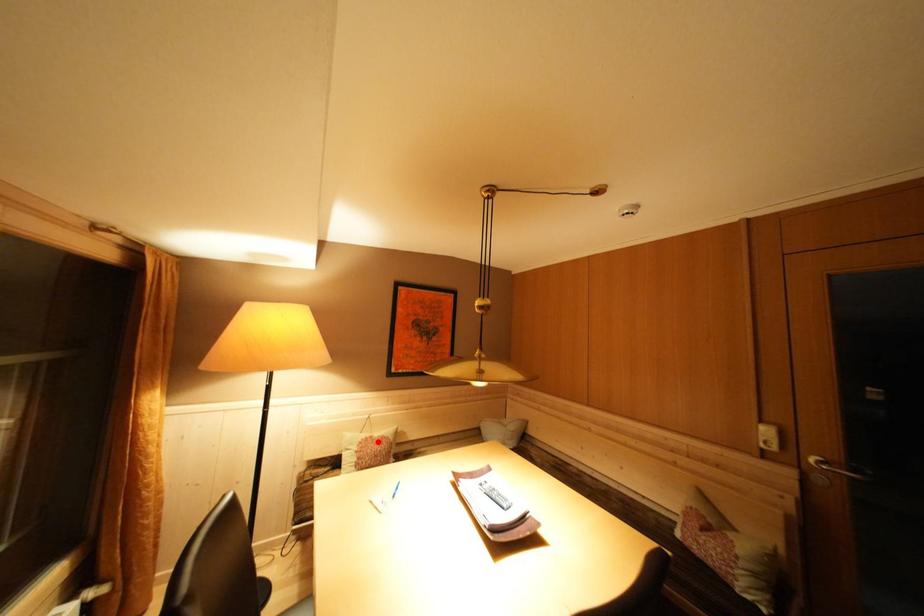
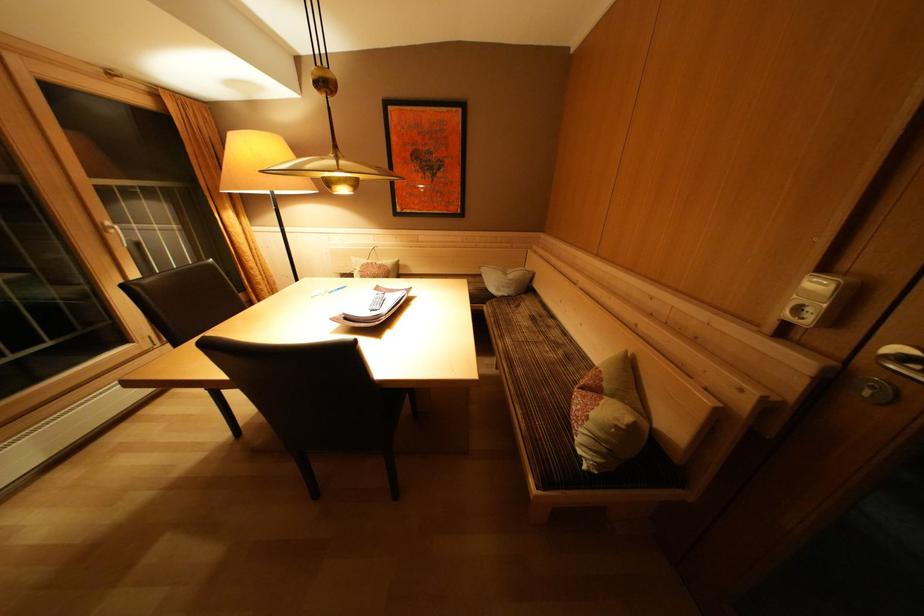
The point at the highlighted location is marked in the first image. Where is the corresponding point in the second image?

(379, 268)